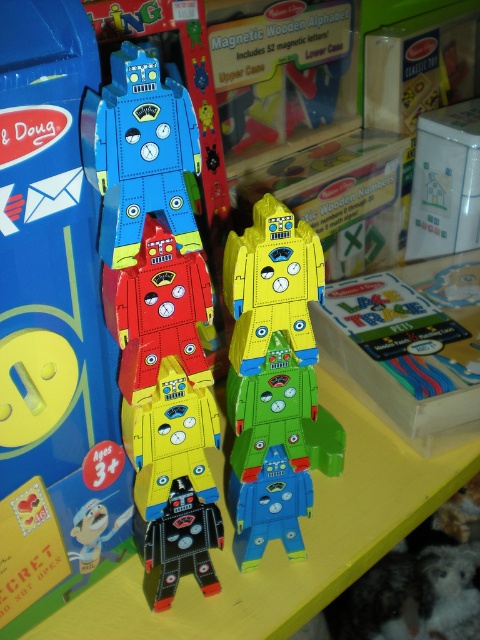
Who is lower down, shiny red robot at center or blue matte robot at center?

blue matte robot at center is lower down.

Which is in front, point (200, 266) or point (271, 502)?

Point (200, 266) is in front.

Locate an element on the screen. The width and height of the screenshot is (480, 640). shiny red robot at center is located at coordinates (157, 310).

Can you confirm if matte cardboard robot at center is taller than blue matte robot at center?

Indeed, matte cardboard robot at center has a greater height compared to blue matte robot at center.

Where is `matte cardboard robot at center`? Image resolution: width=480 pixels, height=640 pixels. matte cardboard robot at center is located at coordinates (140, 154).

Is point (188, 156) positioned in front of point (235, 512)?

Yes, point (188, 156) is in front of point (235, 512).

Where is `matte cardboard robot at center`? This screenshot has width=480, height=640. matte cardboard robot at center is located at coordinates (140, 154).

Between point (308, 356) and point (182, 492), which one is positioned in front?

Positioned in front is point (308, 356).

Can you confirm if yellow matte robot at center is bigger than shiny black robot at center?

Indeed, yellow matte robot at center has a larger size compared to shiny black robot at center.

This screenshot has width=480, height=640. In order to click on yellow matte robot at center in this screenshot , I will do `click(272, 285)`.